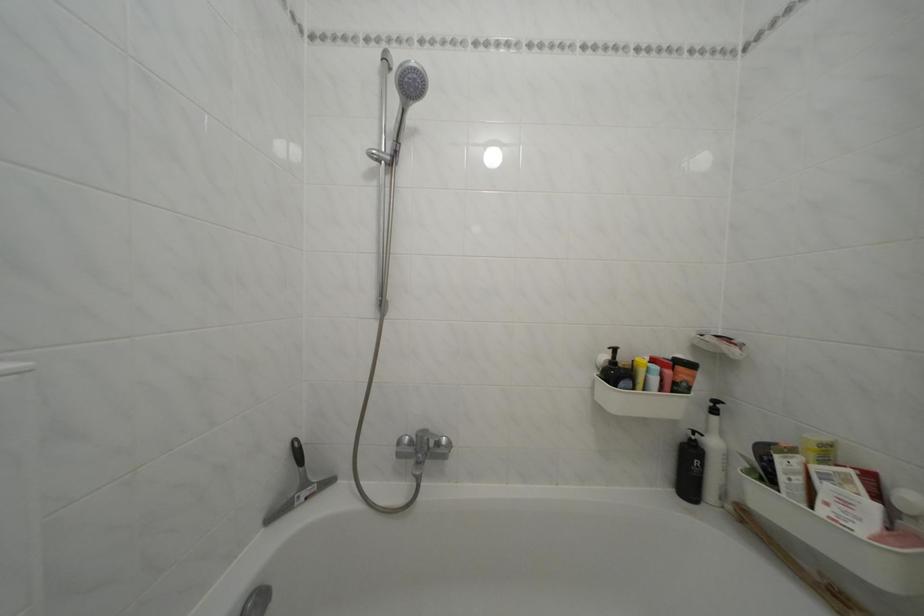
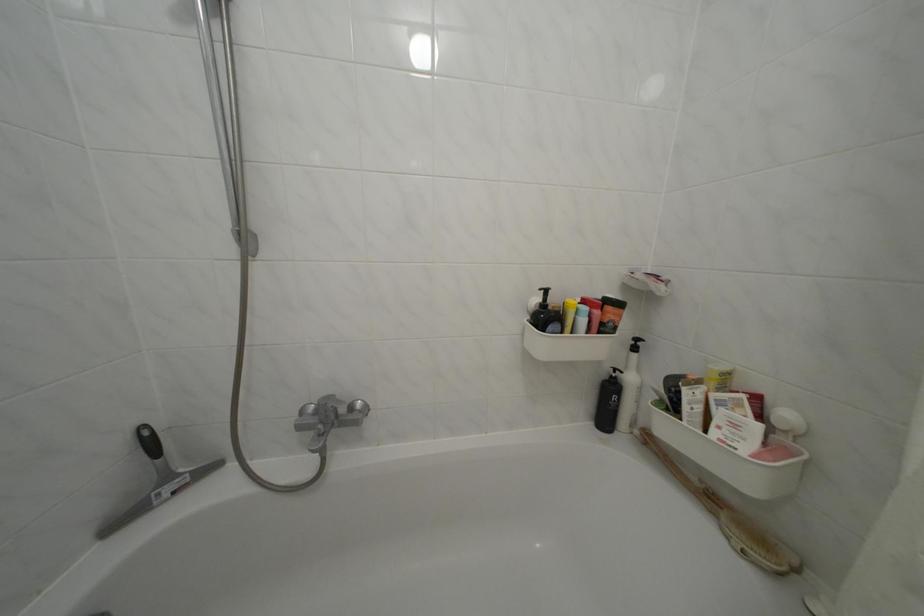
Locate, in the second image, the point that corresponds to point (737, 514) in the first image.

(646, 438)